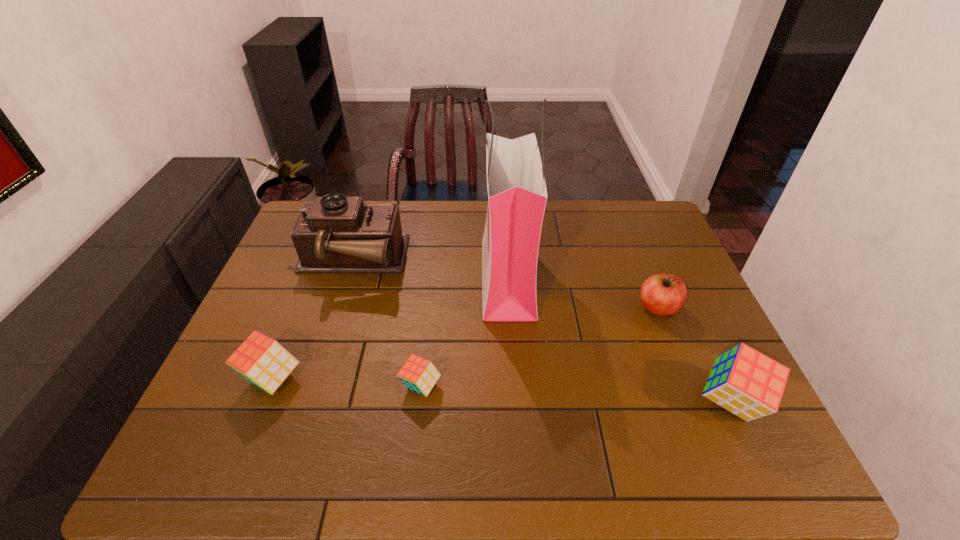
Where is `free location that satisfies the following two spatial constraints: 1. on the front-facing side of the tallest object; 2. on the right side of the apple`? The image size is (960, 540). free location that satisfies the following two spatial constraints: 1. on the front-facing side of the tallest object; 2. on the right side of the apple is located at coordinates (510, 307).